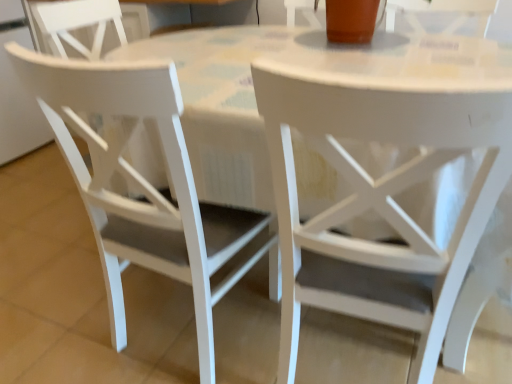
Question: From the image's perspective, is white matte chair at left, the 1th chair when ordered from left to right, positioned above or below white matte chair at center, positioned as the second chair in left-to-right order?

Choices:
 (A) above
 (B) below

Answer: (A)

Question: Considering the relative positions of white matte chair at left, the 1th chair when ordered from left to right, and white matte chair at center, positioned as the second chair in left-to-right order, in the image provided, is white matte chair at left, the 1th chair when ordered from left to right, to the left or to the right of white matte chair at center, positioned as the second chair in left-to-right order,?

Choices:
 (A) left
 (B) right

Answer: (A)

Question: In terms of width, does white matte chair at left, which is the 2th chair in right-to-left order, look wider or thinner when compared to white matte chair at center, positioned as the second chair in left-to-right order?

Choices:
 (A) thin
 (B) wide

Answer: (A)

Question: Visually, is white matte chair at center, positioned as the second chair in left-to-right order, positioned to the left or to the right of white matte chair at left, which is the 2th chair in right-to-left order?

Choices:
 (A) right
 (B) left

Answer: (A)

Question: Is point (481, 114) closer or farther from the camera than point (166, 223)?

Choices:
 (A) farther
 (B) closer

Answer: (B)

Question: Would you say white matte chair at center, which is counted as the first chair, starting from the right, is inside or outside white matte chair at left, which is the 2th chair in right-to-left order?

Choices:
 (A) outside
 (B) inside

Answer: (A)

Question: In terms of size, does white matte chair at center, which is counted as the first chair, starting from the right, appear bigger or smaller than white matte chair at left, which is the 2th chair in right-to-left order?

Choices:
 (A) big
 (B) small

Answer: (A)